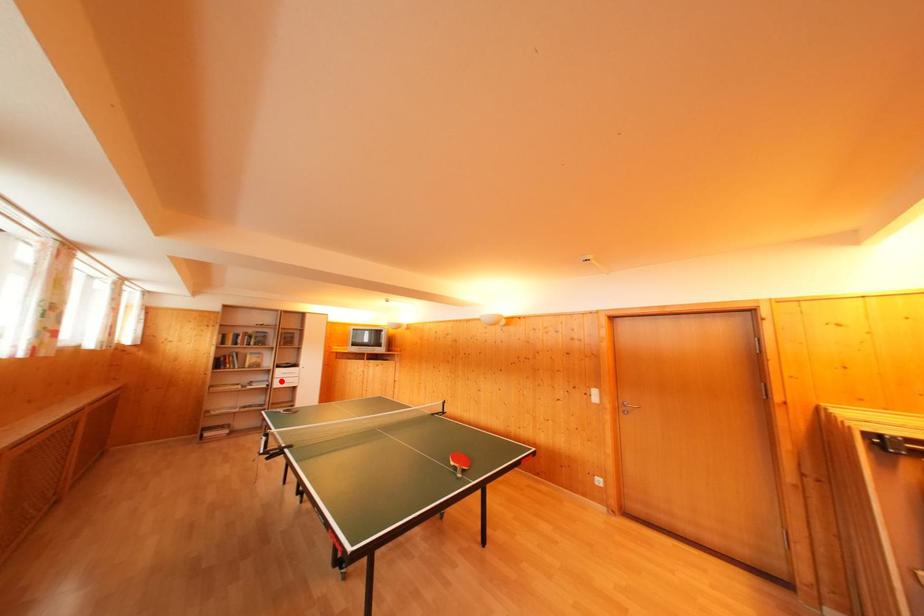
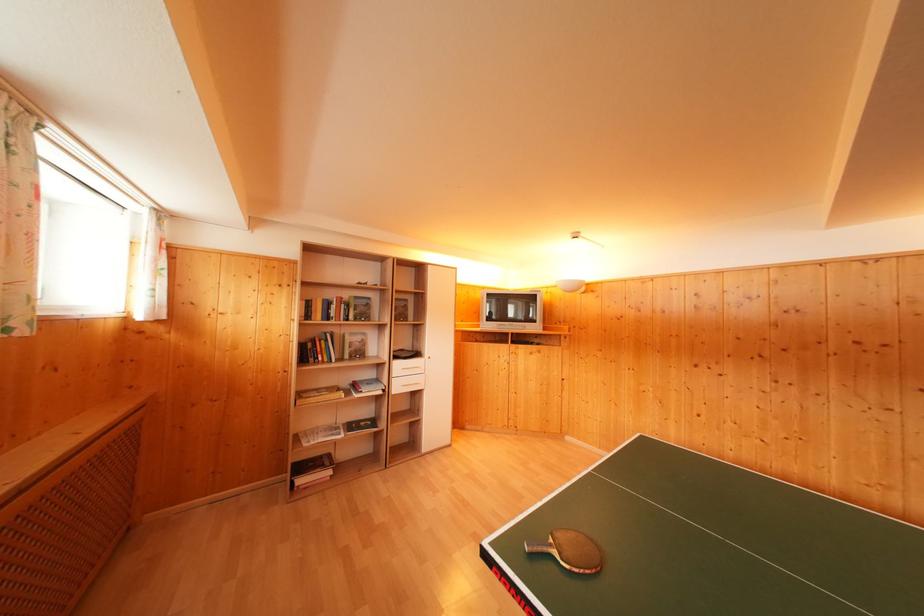
Where in the second image is the point corresponding to the highlighted location from the first image?

(398, 379)